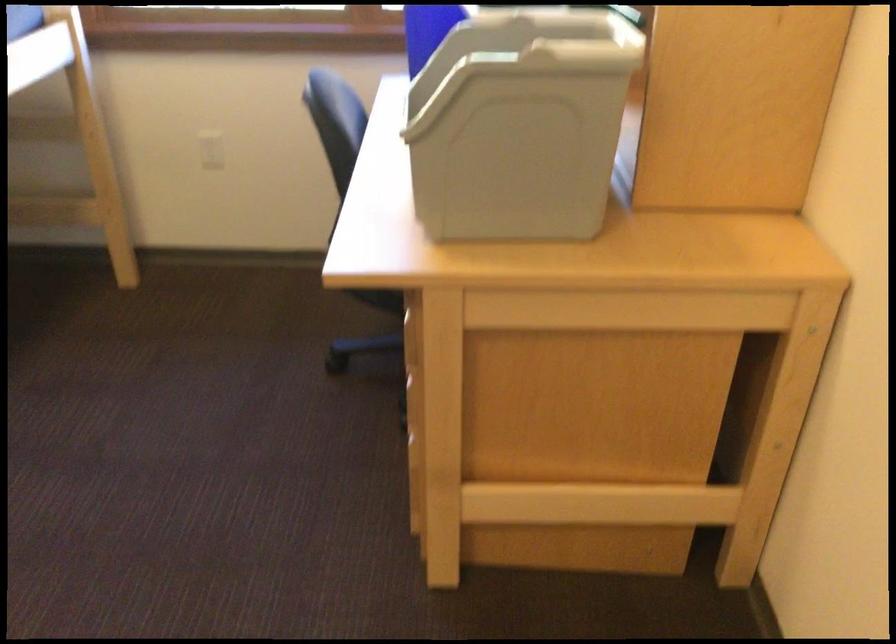
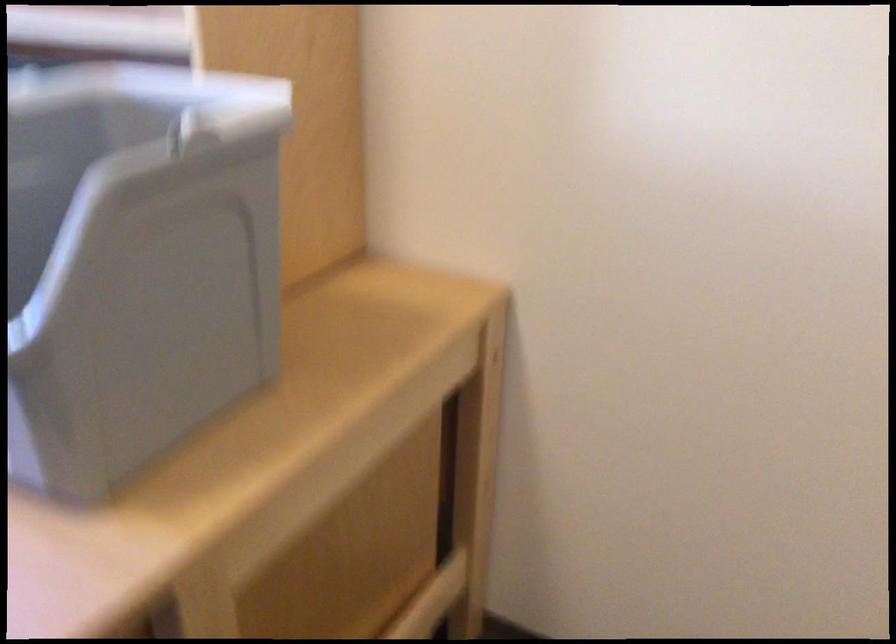
In the second image, find the point that corresponds to point (487, 118) in the first image.

(135, 263)